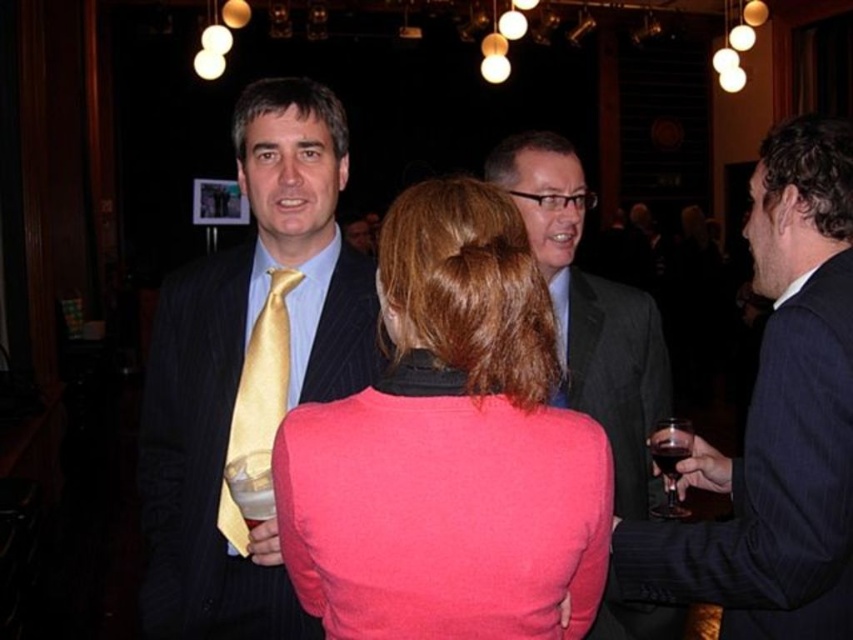
Does matte black suit at center appear under gold satin tie at center?

No, matte black suit at center is not below gold satin tie at center.

Is matte black suit at center to the right of gold satin tie at center from the viewer's perspective?

Indeed, matte black suit at center is positioned on the right side of gold satin tie at center.

Is point (563, 339) positioned before point (280, 276)?

No, it is behind (280, 276).

Where is `matte black suit at center`? This screenshot has width=853, height=640. matte black suit at center is located at coordinates (590, 310).

Who is more distant from viewer, (755, 168) or (630, 634)?

The point (755, 168) is behind.

Does matte black suit at right appear over matte black suit at center?

Correct, matte black suit at right is located above matte black suit at center.

Which is behind, point (776, 188) or point (643, 436)?

The point (643, 436) is behind.

This screenshot has width=853, height=640. What are the coordinates of `matte black suit at right` in the screenshot? It's located at coord(776,420).

Is matte pink sweater at center in front of gold satin tie at center?

Yes, it is.

Can you confirm if matte pink sweater at center is taller than gold satin tie at center?

Indeed, matte pink sweater at center has a greater height compared to gold satin tie at center.

Is point (453, 269) farther from camera compared to point (256, 460)?

No, it is in front of (256, 460).

The image size is (853, 640). What are the coordinates of `matte pink sweater at center` in the screenshot? It's located at (450, 449).